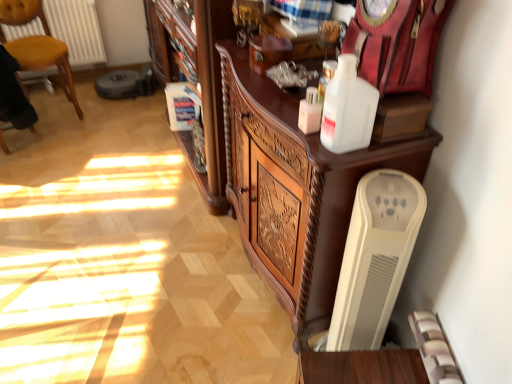
Question: Does velvet black armchair at left lie behind white plastic bottle at upper center, which appears as the second bottle when viewed from the left?

Choices:
 (A) yes
 (B) no

Answer: (A)

Question: From a real-world perspective, is velvet black armchair at left on white plastic bottle at upper center, positioned as the first bottle in right-to-left order?

Choices:
 (A) yes
 (B) no

Answer: (B)

Question: From the image's perspective, is velvet black armchair at left on top of white plastic bottle at upper center, which appears as the second bottle when viewed from the left?

Choices:
 (A) no
 (B) yes

Answer: (B)

Question: From a real-world perspective, is velvet black armchair at left beneath white plastic bottle at upper center, positioned as the first bottle in right-to-left order?

Choices:
 (A) yes
 (B) no

Answer: (A)

Question: Does velvet black armchair at left have a larger size compared to white plastic bottle at upper center, which appears as the second bottle when viewed from the left?

Choices:
 (A) no
 (B) yes

Answer: (B)

Question: In the image, is white plastic bottle at upper center, positioned as the first bottle in right-to-left order, on the left side or the right side of white plastic heater at lower right?

Choices:
 (A) left
 (B) right

Answer: (A)

Question: Is white plastic bottle at upper center, positioned as the first bottle in right-to-left order, inside or outside of white plastic heater at lower right?

Choices:
 (A) outside
 (B) inside

Answer: (A)

Question: Based on their sizes in the image, would you say white plastic bottle at upper center, positioned as the first bottle in right-to-left order, is bigger or smaller than white plastic heater at lower right?

Choices:
 (A) big
 (B) small

Answer: (B)

Question: In terms of width, does white plastic bottle at upper center, positioned as the first bottle in right-to-left order, look wider or thinner when compared to white plastic heater at lower right?

Choices:
 (A) wide
 (B) thin

Answer: (B)

Question: Looking at the image, does yellow upholstered chair at left seem bigger or smaller compared to white glossy bottle at upper center, the 2th bottle in the right-to-left sequence?

Choices:
 (A) small
 (B) big

Answer: (B)

Question: Considering their positions, is yellow upholstered chair at left located in front of or behind white glossy bottle at upper center, the 2th bottle in the right-to-left sequence?

Choices:
 (A) front
 (B) behind

Answer: (B)

Question: Is yellow upholstered chair at left taller or shorter than white glossy bottle at upper center, the 2th bottle in the right-to-left sequence?

Choices:
 (A) short
 (B) tall

Answer: (B)

Question: Visually, is yellow upholstered chair at left positioned to the left or to the right of white glossy bottle at upper center, the 2th bottle in the right-to-left sequence?

Choices:
 (A) right
 (B) left

Answer: (B)

Question: From the image's perspective, is white plastic heater at lower right positioned above or below yellow upholstered chair at left?

Choices:
 (A) below
 (B) above

Answer: (A)

Question: Considering the positions of white plastic heater at lower right and yellow upholstered chair at left in the image, is white plastic heater at lower right wider or thinner than yellow upholstered chair at left?

Choices:
 (A) wide
 (B) thin

Answer: (B)